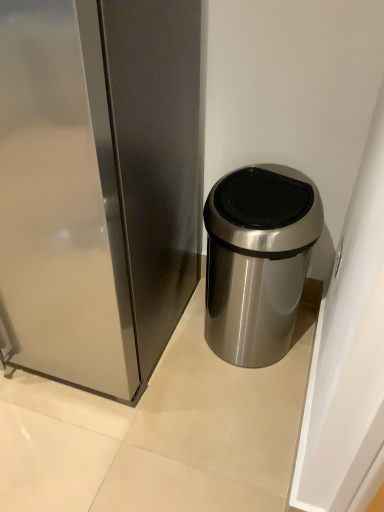
Question: Based on their positions, is satin silver trash can at right located to the left or right of satin silver trash can at center?

Choices:
 (A) left
 (B) right

Answer: (A)

Question: From the image's perspective, is satin silver trash can at right positioned above or below satin silver trash can at center?

Choices:
 (A) above
 (B) below

Answer: (A)

Question: Considering the positions of point (196, 134) and point (283, 331), is point (196, 134) closer or farther from the camera than point (283, 331)?

Choices:
 (A) closer
 (B) farther

Answer: (A)

Question: In terms of height, does satin silver trash can at center look taller or shorter compared to satin silver trash can at right?

Choices:
 (A) short
 (B) tall

Answer: (A)

Question: From a real-world perspective, relative to satin silver trash can at right, is satin silver trash can at center vertically above or below?

Choices:
 (A) below
 (B) above

Answer: (A)

Question: In the image, is satin silver trash can at center positioned in front of or behind satin silver trash can at right?

Choices:
 (A) front
 (B) behind

Answer: (B)

Question: Considering the positions of point (210, 280) and point (165, 183), is point (210, 280) closer or farther from the camera than point (165, 183)?

Choices:
 (A) farther
 (B) closer

Answer: (A)